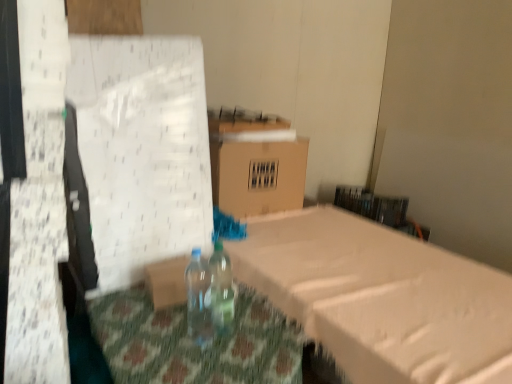
Find the location of a particular element. vacant space in front of translucent plastic bottle at center, which is the second bottle in right-to-left order is located at coordinates (203, 362).